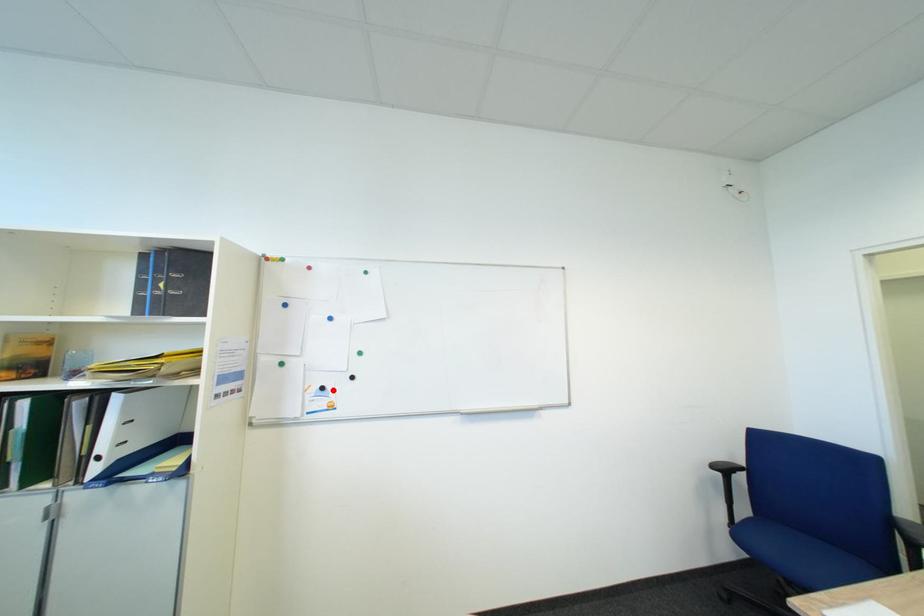
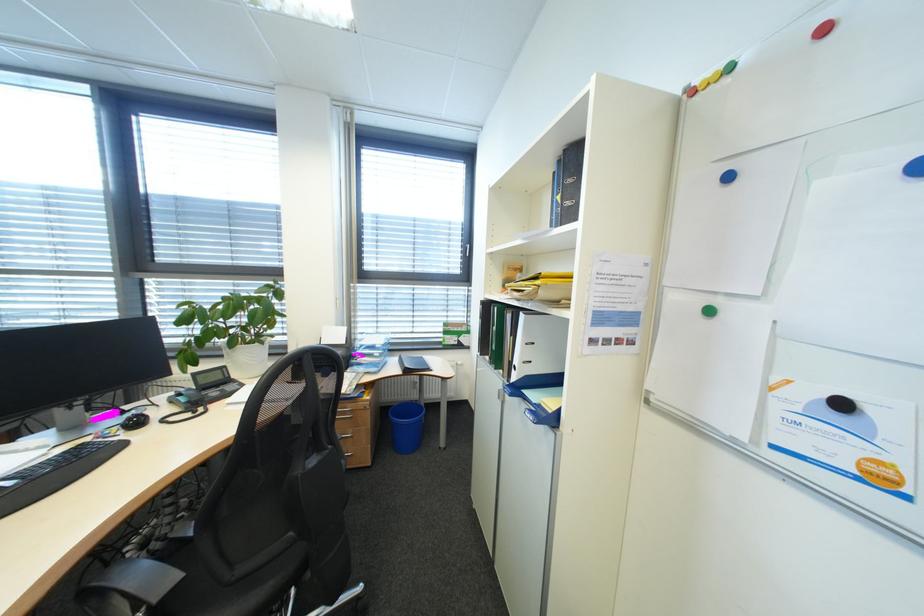
The point at the highlighted location is marked in the first image. Where is the corresponding point in the second image?

(854, 406)